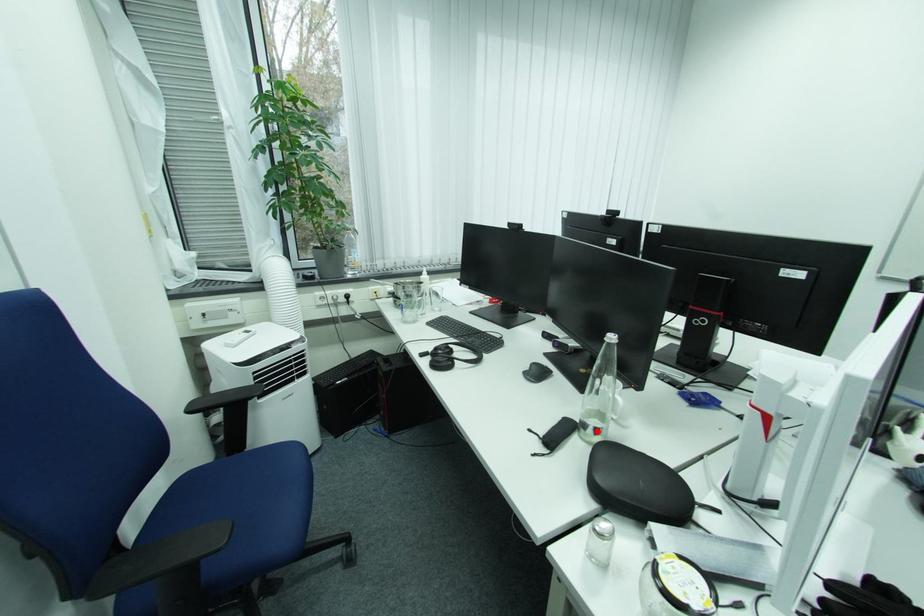
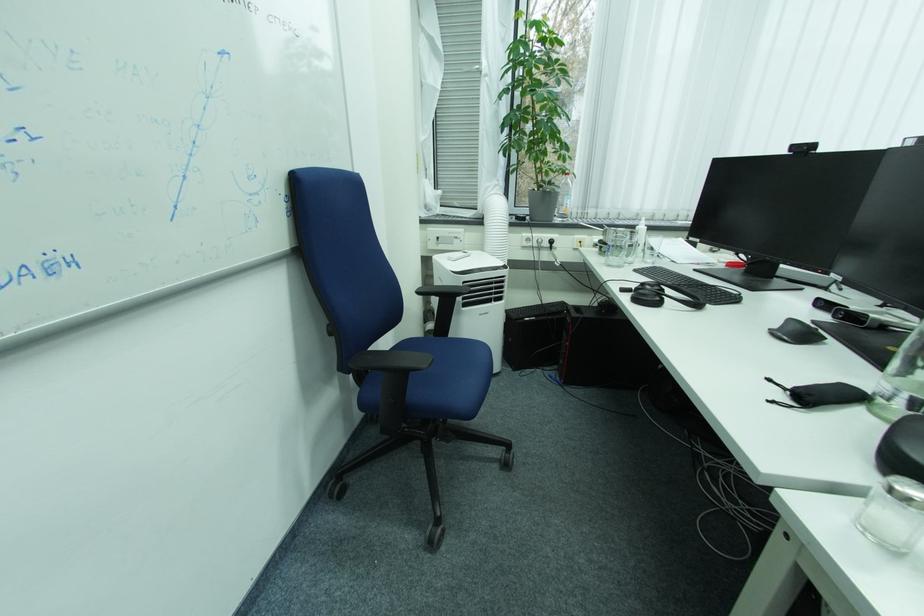
Locate, in the second image, the point that corresponds to the highlighted location in the first image.

(906, 403)